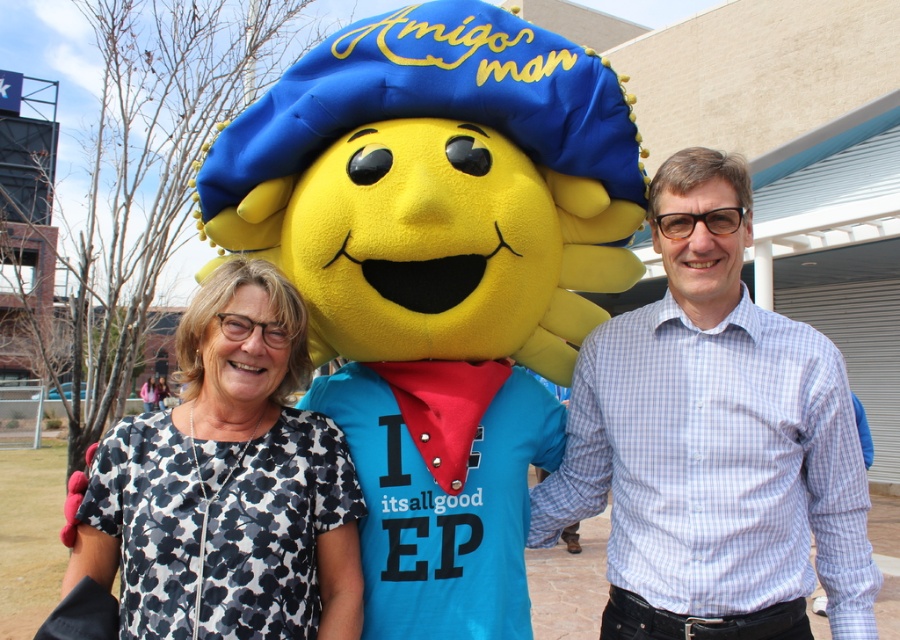
Question: Which point is farther to the camera?

Choices:
 (A) white checkered shirt at center
 (B) white dotted shirt at center
 (C) matte yellow head at center

Answer: (A)

Question: Does matte yellow head at center appear on the right side of white dotted shirt at center?

Choices:
 (A) no
 (B) yes

Answer: (B)

Question: Which of these objects is positioned closest to the matte yellow head at center?

Choices:
 (A) white dotted shirt at center
 (B) white checkered shirt at center

Answer: (A)

Question: Is matte yellow head at center bigger than white dotted shirt at center?

Choices:
 (A) yes
 (B) no

Answer: (A)

Question: Which object appears closest to the camera in this image?

Choices:
 (A) matte yellow head at center
 (B) white dotted shirt at center

Answer: (B)

Question: Is matte yellow head at center above white dotted shirt at center?

Choices:
 (A) yes
 (B) no

Answer: (A)